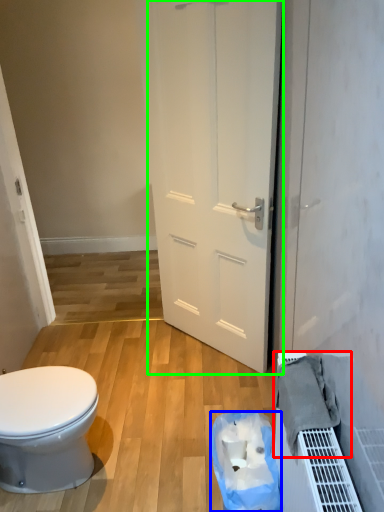
Question: Considering the real-world distances, which object is closest to material (highlighted by a red box)? garbage (highlighted by a blue box) or door (highlighted by a green box).

Choices:
 (A) garbage
 (B) door

Answer: (A)